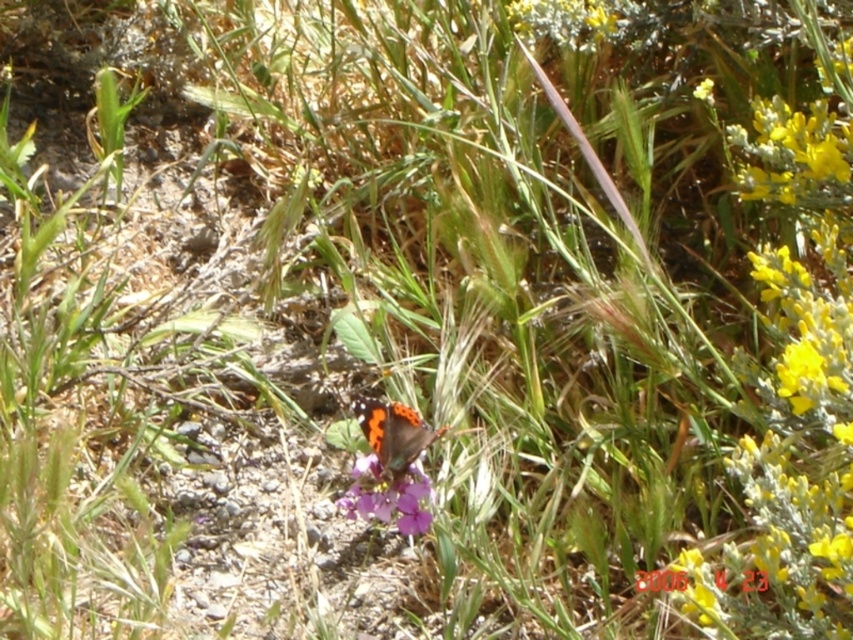
Question: Which point is closer to the camera taking this photo?

Choices:
 (A) (769, 513)
 (B) (376, 445)

Answer: (A)

Question: Which point is closer to the camera?

Choices:
 (A) yellow matte flower at upper right
 (B) orange-patterned wings at center
 (C) purple matte flower at center

Answer: (A)

Question: Among these objects, which one is farthest from the camera?

Choices:
 (A) orange-patterned wings at center
 (B) yellow matte flower at upper right

Answer: (A)

Question: Can you confirm if yellow matte flower at upper right is positioned to the left of orange-patterned wings at center?

Choices:
 (A) yes
 (B) no

Answer: (B)

Question: Can you confirm if yellow matte flower at upper right is bigger than orange-patterned wings at center?

Choices:
 (A) no
 (B) yes

Answer: (B)

Question: Does yellow matte flower at upper right appear under purple matte flower at center?

Choices:
 (A) no
 (B) yes

Answer: (A)